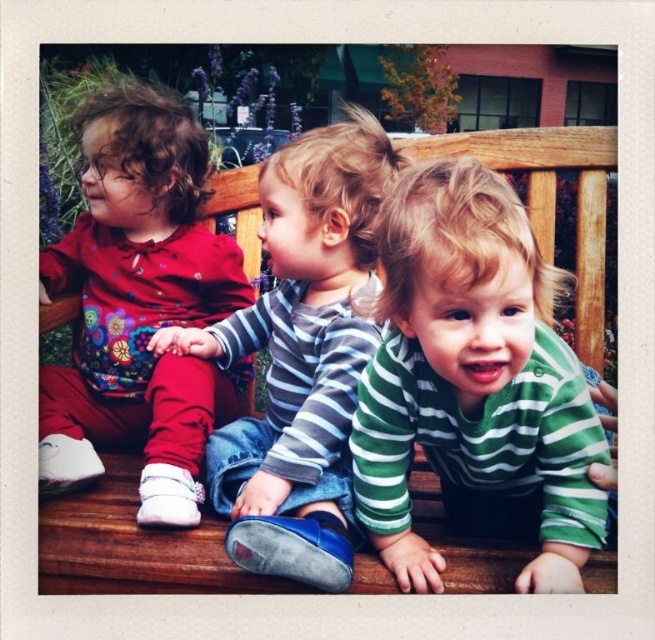
Question: Is green striped shirt at center wider than matte floral shirt at left?

Choices:
 (A) yes
 (B) no

Answer: (B)

Question: Is green striped shirt at center positioned at the back of striped cotton shirt at center?

Choices:
 (A) no
 (B) yes

Answer: (A)

Question: Does green striped shirt at center have a lesser width compared to striped cotton shirt at center?

Choices:
 (A) no
 (B) yes

Answer: (B)

Question: Based on their relative distances, which object is farther from the green striped shirt at center?

Choices:
 (A) striped cotton shirt at center
 (B) matte floral shirt at left

Answer: (B)

Question: Which object is positioned farthest from the green striped shirt at center?

Choices:
 (A) matte floral shirt at left
 (B) striped cotton shirt at center

Answer: (A)

Question: Which point appears farthest from the camera in this image?

Choices:
 (A) pos(402,211)
 (B) pos(166,492)
 (C) pos(333,362)

Answer: (C)